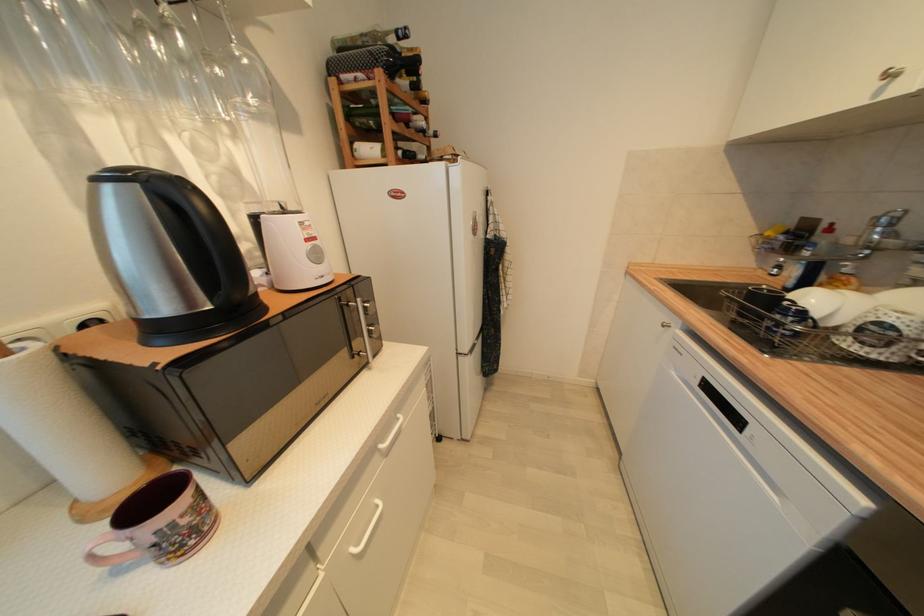
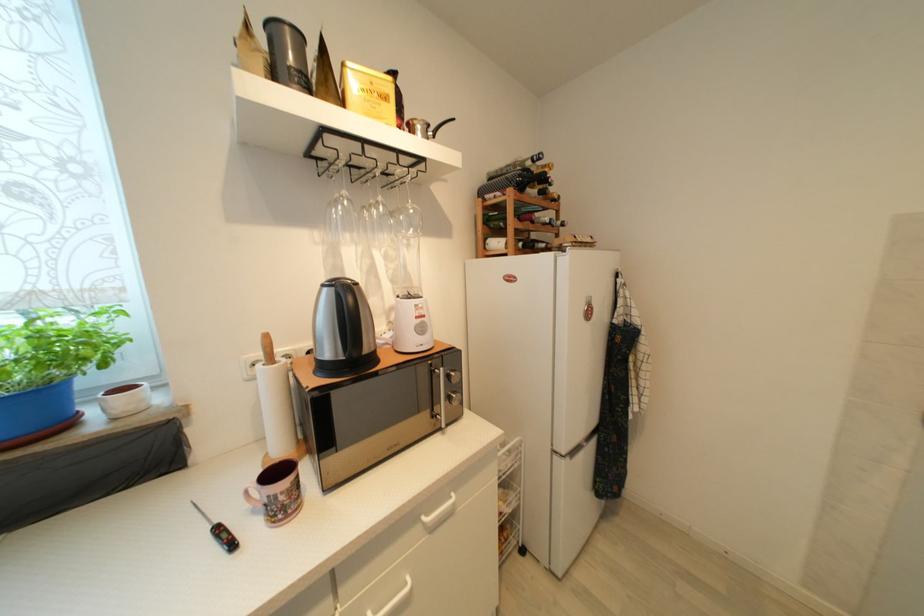
Find the pixel in the second image that matches point (403, 82) in the first image.

(533, 192)